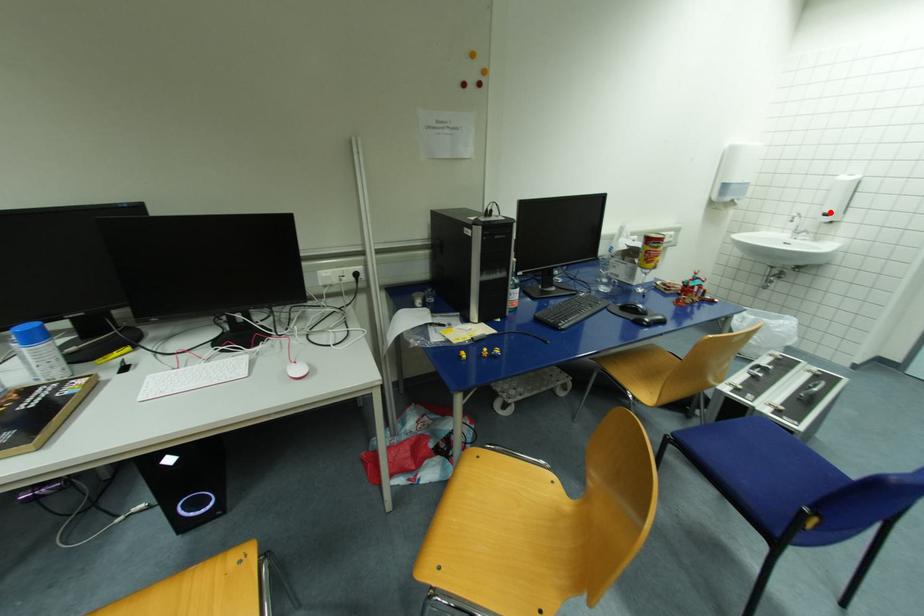
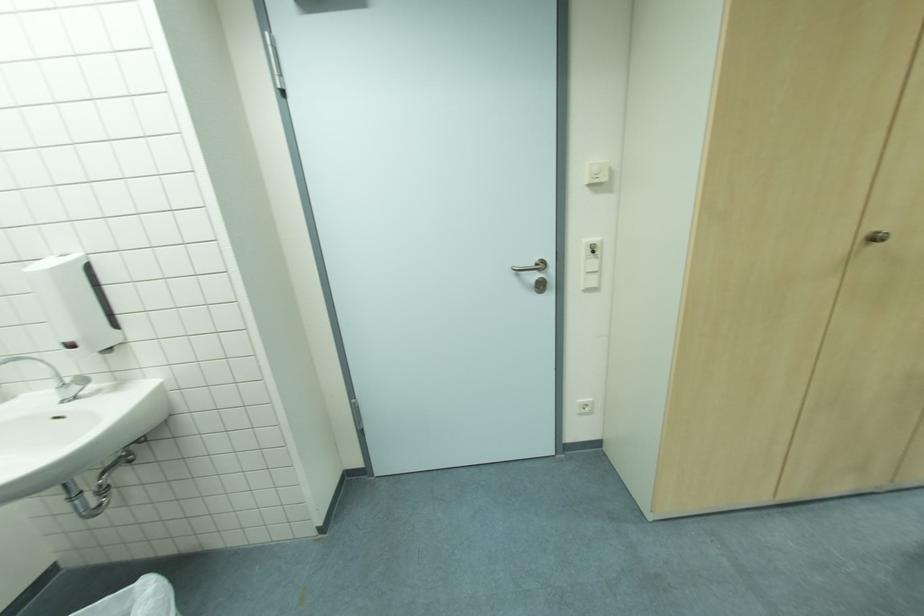
In the second image, find the point that corresponds to the highlighted location in the first image.

(71, 341)